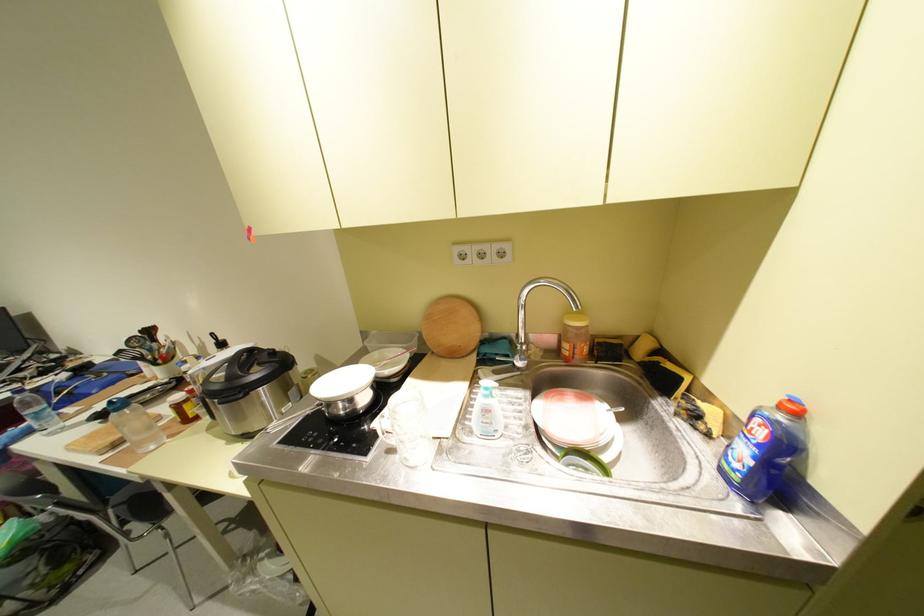
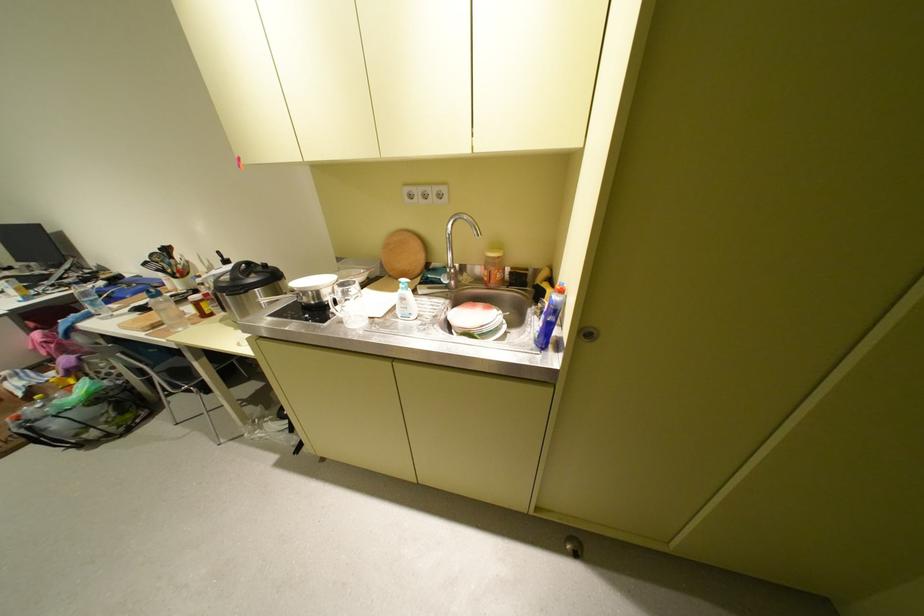
Locate, in the second image, the point that corresponds to (x=358, y=414) in the first image.

(326, 304)